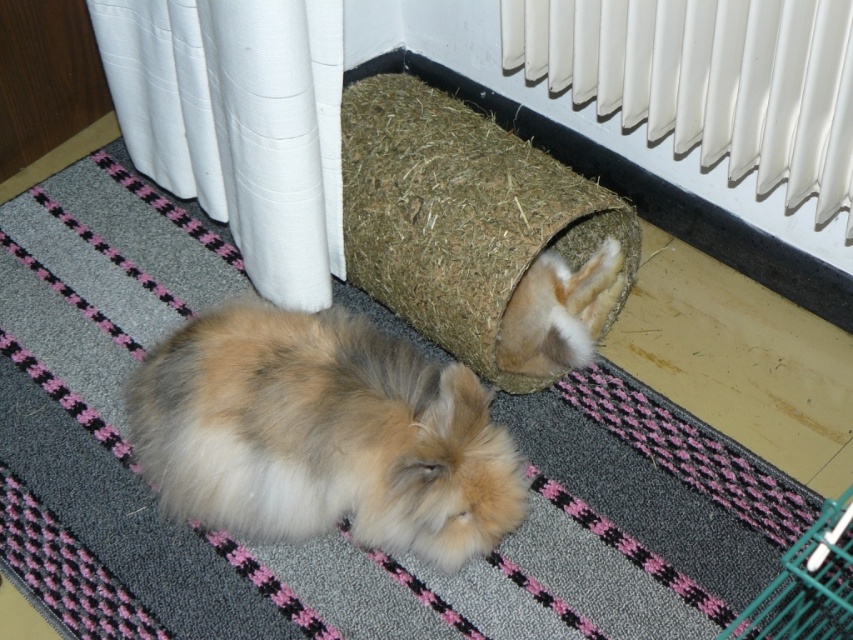
You are standing in the room and want to reach the white fabric curtain at left without moving your feet. Can you touch it with your outstretched hand?

The white fabric curtain at left is 4.15 feet away from the camera, so if you can reach 4.15 feet with your outstretched hand, you can touch it.

You are a small toy mouse that is 5 cm tall. You want to hide behind the white plastic radiator at upper right to avoid the fuzzy brown rabbit at lower center. Can you fit behind it without being seen?

The white plastic radiator at upper right is taller than the fuzzy brown rabbit at lower center, so yes, the toy mouse can hide behind the white plastic radiator at upper right without being seen.